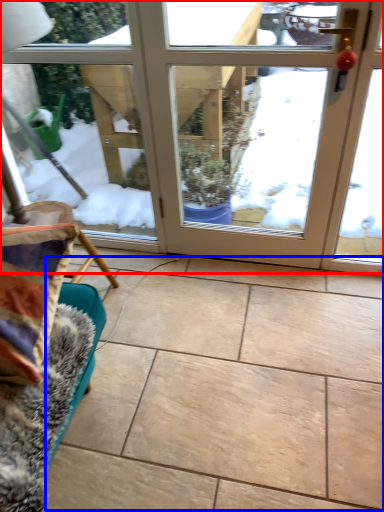
Question: Which of the following is the farthest to the observer, door (highlighted by a red box) or ceramic tile (highlighted by a blue box)?

Choices:
 (A) door
 (B) ceramic tile

Answer: (A)